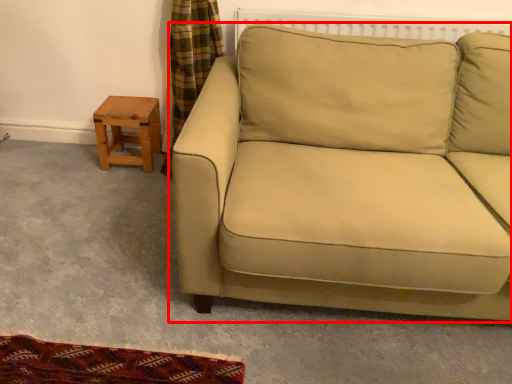
Question: From the image's perspective, what is the correct spatial relationship of studio couch (annotated by the red box) in relation to table?

Choices:
 (A) above
 (B) below

Answer: (B)